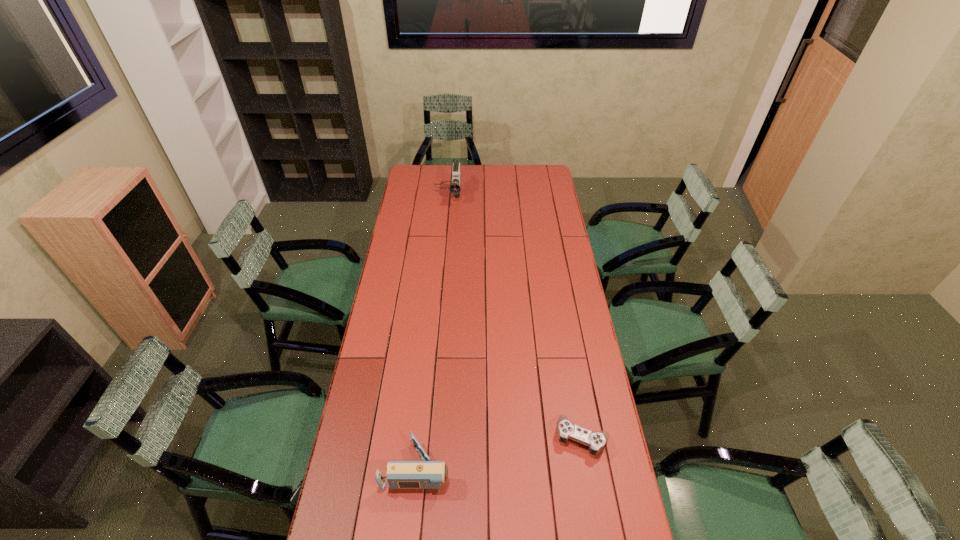
This screenshot has width=960, height=540. What are the coordinates of `object situated at the left edge` in the screenshot? It's located at (427, 474).

This screenshot has height=540, width=960. I want to click on object that is at the right edge, so click(596, 441).

The width and height of the screenshot is (960, 540). Identify the location of free space at the far edge of the desktop. (496, 166).

This screenshot has height=540, width=960. In order to click on free space at the left edge of the desktop in this screenshot , I will do `click(351, 518)`.

The image size is (960, 540). What are the coordinates of `free location at the right edge of the desktop` in the screenshot? It's located at (552, 319).

You are a GUI agent. You are given a task and a screenshot of the screen. Output one action in this format:
    pyautogui.click(x=<x>, y=<y>)
    Task: Click on the vacant area that lies between the second shortest object and the control
    
    Given the screenshot: What is the action you would take?
    pyautogui.click(x=500, y=452)

Where is `vacant space that is in between the farthest object and the rightmost object`? The image size is (960, 540). vacant space that is in between the farthest object and the rightmost object is located at coordinates (515, 317).

At what (x,y) coordinates should I click in order to perform the action: click on unoccupied position between the control and the farthest object. Please return your answer as a coordinate pair (x, y). The width and height of the screenshot is (960, 540). Looking at the image, I should click on click(515, 317).

Image resolution: width=960 pixels, height=540 pixels. Identify the location of vacant point located between the tallest object and the nearer camcorder. (433, 332).

The image size is (960, 540). I want to click on free point between the nearer camcorder and the farther camcorder, so click(x=433, y=332).